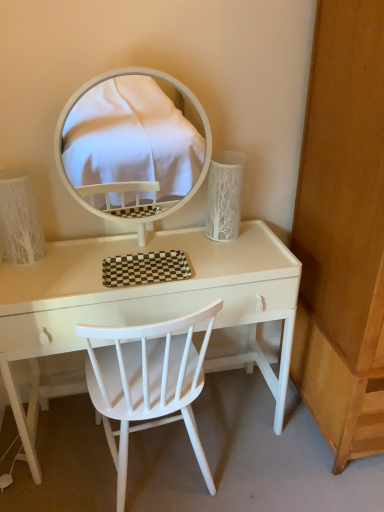
Identify the location of vacant area that is situated to the right of white glossy mirror at upper center. (230, 256).